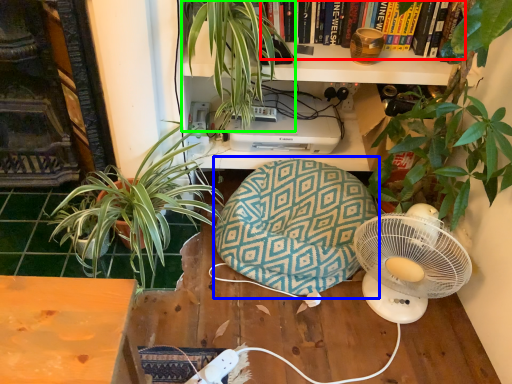
Question: Estimate the real-world distances between objects in this image. Which object is closer to book (highlighted by a red box), bean bag chair (highlighted by a blue box) or houseplant (highlighted by a green box)?

Choices:
 (A) bean bag chair
 (B) houseplant

Answer: (B)